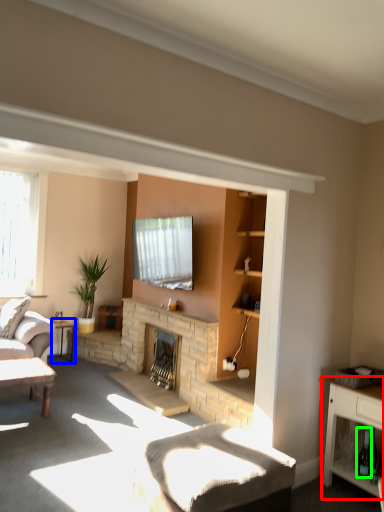
Question: Which object is positioned closest to cabinetry (highlighted by a red box)? Select from table (highlighted by a blue box) and wine bottle (highlighted by a green box).

Choices:
 (A) table
 (B) wine bottle

Answer: (B)